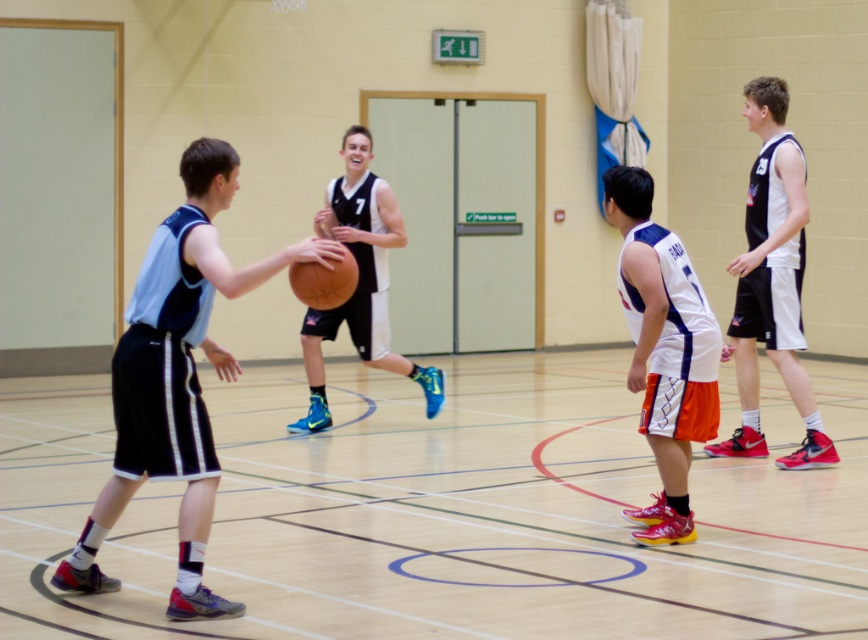
Can you confirm if white matte jersey at center is shorter than matte black basketball at center?

Yes, white matte jersey at center is shorter than matte black basketball at center.

Is point (689, 285) positioned in front of point (347, 177)?

Yes, point (689, 285) is closer to viewer.

This screenshot has height=640, width=868. Identify the location of white matte jersey at center. (663, 349).

Is white matte jersey at center in front of rubber textured basketball at center?

That is False.

Between white matte jersey at center and rubber textured basketball at center, which one appears on the right side from the viewer's perspective?

white matte jersey at center is more to the right.

Locate an element on the screen. This screenshot has height=640, width=868. white matte jersey at center is located at coordinates (663, 349).

What do you see at coordinates (176, 378) in the screenshot? This screenshot has height=640, width=868. I see `matte blue jersey at center` at bounding box center [176, 378].

Does point (109, 588) come in front of point (313, 298)?

Yes.

This screenshot has width=868, height=640. What do you see at coordinates (176, 378) in the screenshot?
I see `matte blue jersey at center` at bounding box center [176, 378].

You are a GUI agent. You are given a task and a screenshot of the screen. Output one action in this format:
    pyautogui.click(x=<x>, y=<y>)
    Task: Click on the matte blue jersey at center
    
    Given the screenshot: What is the action you would take?
    pyautogui.click(x=176, y=378)